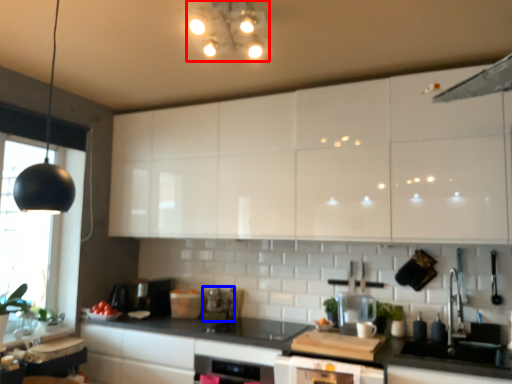
Question: Among these objects, which one is nearest to the camera, light fixture (highlighted by a red box) or appliance (highlighted by a blue box)?

Choices:
 (A) light fixture
 (B) appliance

Answer: (A)